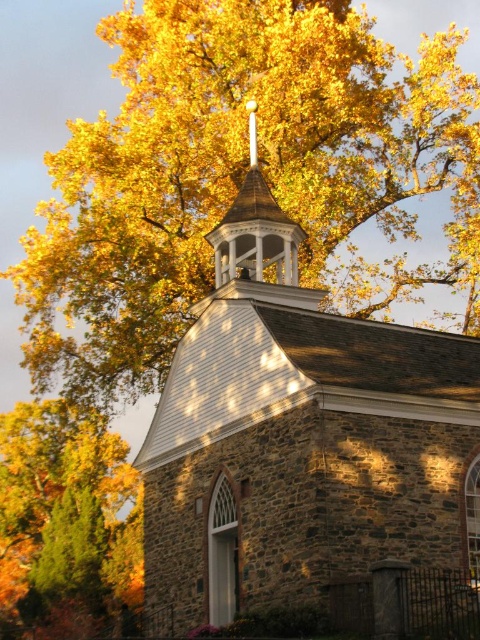
Measure the distance between golden leafy tree at upper left and camera.

golden leafy tree at upper left and camera are 67.90 meters apart.

Find the location of a particular element. The height and width of the screenshot is (640, 480). golden leafy tree at upper left is located at coordinates (60, 516).

Does point (96, 602) lie in front of point (252, 112)?

No, (96, 602) is behind (252, 112).

The image size is (480, 640). Find the location of `golden leafy tree at upper left`. golden leafy tree at upper left is located at coordinates (60, 516).

Is golden leafy tree at upper center smaller than white wood spire at center?

Incorrect, golden leafy tree at upper center is not smaller in size than white wood spire at center.

Does golden leafy tree at upper center have a larger size compared to white wood spire at center?

Correct, golden leafy tree at upper center is larger in size than white wood spire at center.

Between point (296, 8) and point (276, 260), which one is positioned in front?

Positioned in front is point (276, 260).

This screenshot has height=640, width=480. Identify the location of golden leafy tree at upper center. (230, 173).

Does golden leafy tree at upper center have a greater height compared to stone church at center?

Indeed, golden leafy tree at upper center has a greater height compared to stone church at center.

Where is `golden leafy tree at upper center`? The height and width of the screenshot is (640, 480). golden leafy tree at upper center is located at coordinates (230, 173).